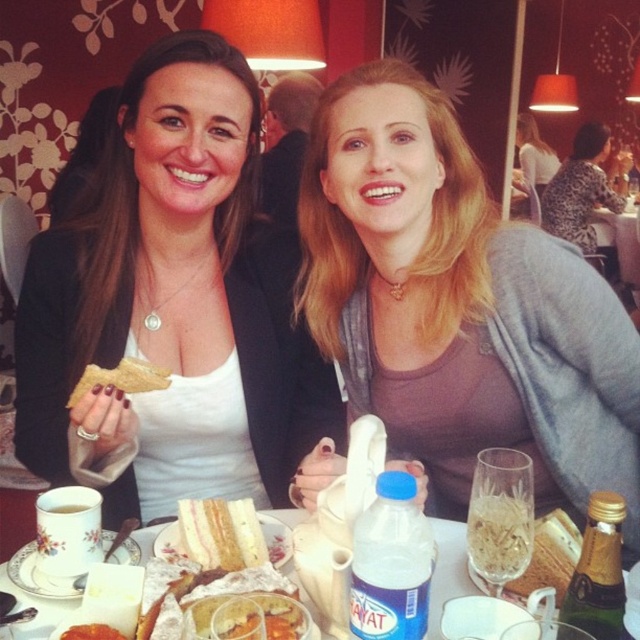
Which is more to the left, matte gray sweater at upper right or golden crisp bread at upper left?

Positioned to the left is golden crisp bread at upper left.

Is point (529, 164) more distant than point (132, 364)?

That is True.

You are a GUI agent. You are given a task and a screenshot of the screen. Output one action in this format:
    pyautogui.click(x=<x>, y=<y>)
    Task: Click on the matte gray sweater at upper right
    Image resolution: width=640 pixels, height=640 pixels.
    Given the screenshot: What is the action you would take?
    pyautogui.click(x=532, y=161)

Does pink sponge cake at center have a greater height compared to matte gray sweater at upper right?

No.

Is pink sponge cake at center shorter than matte gray sweater at upper right?

Correct, pink sponge cake at center is not as tall as matte gray sweater at upper right.

Does point (196, 534) lie behind point (534, 154)?

No, it is in front of (534, 154).

The image size is (640, 640). What are the coordinates of `pink sponge cake at center` in the screenshot? It's located at (221, 532).

Is matte white shirt at center taller than matte gray sweater at center?

Yes, matte white shirt at center is taller than matte gray sweater at center.

In the scene shown: Which of these two, matte white shirt at center or matte gray sweater at center, stands shorter?

matte gray sweater at center is shorter.

What do you see at coordinates (177, 307) in the screenshot? The width and height of the screenshot is (640, 640). I see `matte white shirt at center` at bounding box center [177, 307].

The image size is (640, 640). What are the coordinates of `matte white shirt at center` in the screenshot? It's located at (177, 307).